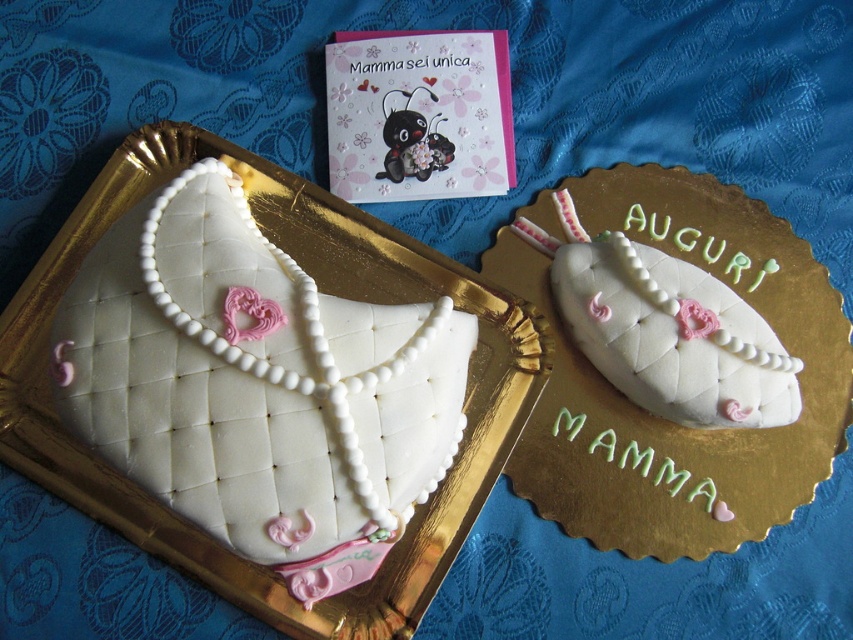
You are at a birthday party and see the white fondant purse at upper left and the white fondant purse at upper center on the table. Which one would you have to move first to reach the cake behind them?

The white fondant purse at upper left is in front of the white fondant purse at upper center, so you would need to move the white fondant purse at upper left first to access the cake behind them.

You are planning to place a small candle that is 2 inches tall on the gold tray. Considering the distance between the white fondant purse at upper left and the white fondant purse at upper center, will the candle fit between them without touching either purse?

The white fondant purse at upper left is 13.20 inches away from the white fondant purse at upper center. Since the candle is only 2 inches tall, it will not interfere with the distance between the purses and can be placed between them without touching either.